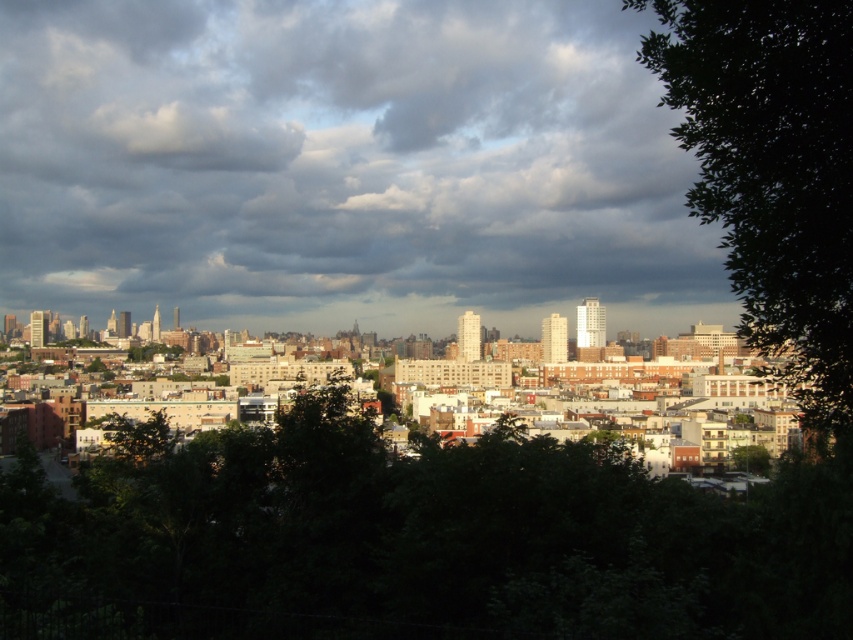
Can you confirm if cloudy sky at upper center is shorter than green leafy tree at center?

No, cloudy sky at upper center is not shorter than green leafy tree at center.

Between point (86, 264) and point (80, 492), which one is positioned behind?

The point (86, 264) is more distant.

Find the location of a particular element. cloudy sky at upper center is located at coordinates (341, 161).

Can you confirm if cloudy sky at upper center is wider than green leafy tree at right?

Yes, cloudy sky at upper center is wider than green leafy tree at right.

Is point (109, 138) less distant than point (691, 67)?

That is False.

Where is `cloudy sky at upper center`? cloudy sky at upper center is located at coordinates (341, 161).

Does green leafy tree at center appear on the left side of green leafy tree at right?

Indeed, green leafy tree at center is positioned on the left side of green leafy tree at right.

Which is above, green leafy tree at center or green leafy tree at right?

green leafy tree at right

The height and width of the screenshot is (640, 853). I want to click on green leafy tree at center, so click(415, 541).